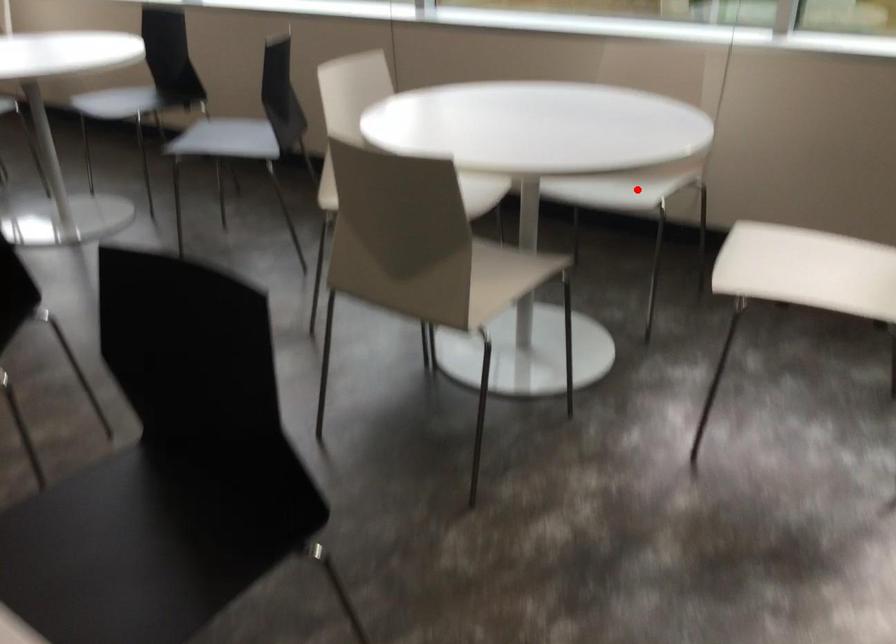
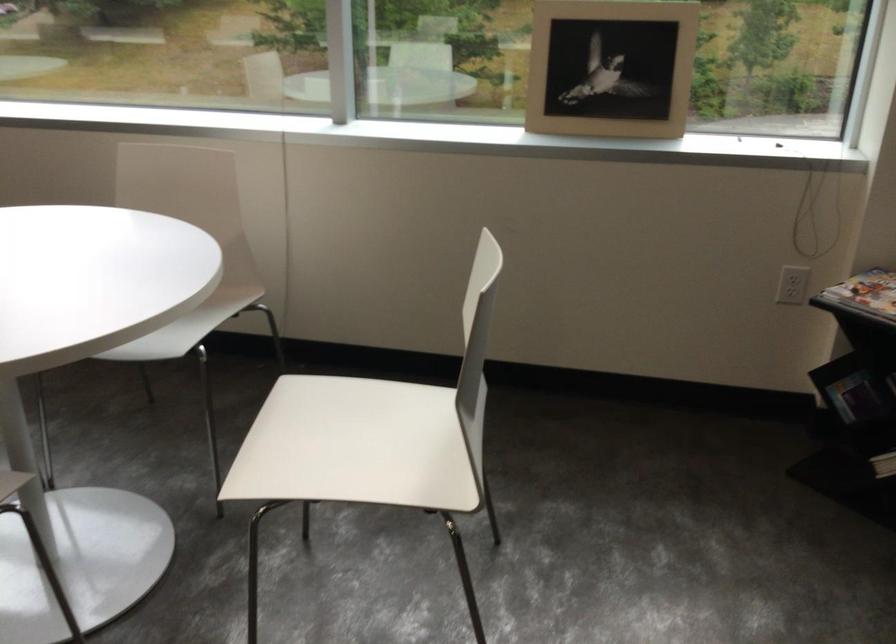
Question: I am providing you with two images of the same scene from different viewpoints. A red point is marked on the first image. At the location where the point appears in image 1, is it still visible in image 2?

Choices:
 (A) Yes
 (B) No

Answer: (A)